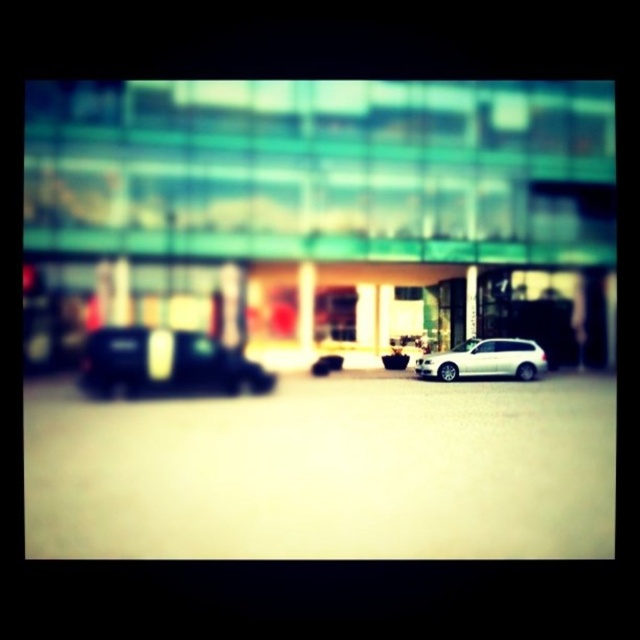
Question: Which point appears farthest from the camera in this image?

Choices:
 (A) (182, 371)
 (B) (518, 346)

Answer: (B)

Question: Does shiny black car at left appear under white matte suv at center?

Choices:
 (A) no
 (B) yes

Answer: (B)

Question: Does shiny black car at left appear on the right side of white matte suv at center?

Choices:
 (A) no
 (B) yes

Answer: (A)

Question: Which point is farther to the camera?

Choices:
 (A) pyautogui.click(x=211, y=346)
 (B) pyautogui.click(x=420, y=376)

Answer: (B)

Question: Is shiny black car at left positioned before white matte suv at center?

Choices:
 (A) yes
 (B) no

Answer: (A)